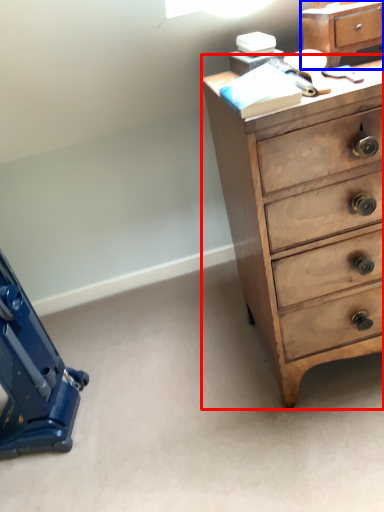
Question: Which object appears closest to the camera in this image, chest of drawers (highlighted by a red box) or file cabinet (highlighted by a blue box)?

Choices:
 (A) chest of drawers
 (B) file cabinet

Answer: (A)